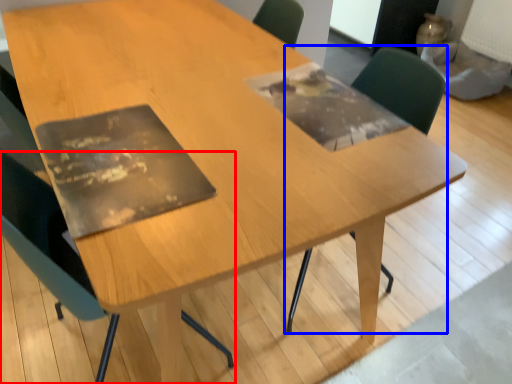
Question: Among these objects, which one is nearest to the camera, chair (highlighted by a red box) or chair (highlighted by a blue box)?

Choices:
 (A) chair
 (B) chair

Answer: (A)